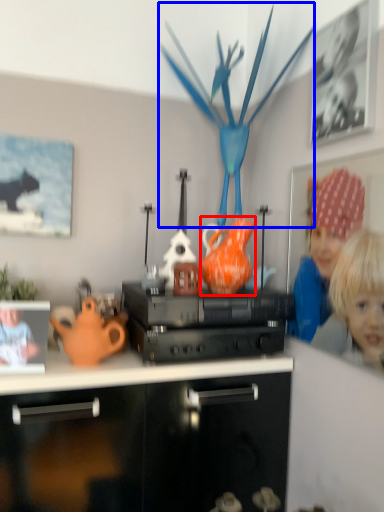
Question: Which point is closer to the camera, tea pot (highlighted by a red box) or toy (highlighted by a blue box)?

Choices:
 (A) tea pot
 (B) toy

Answer: (B)